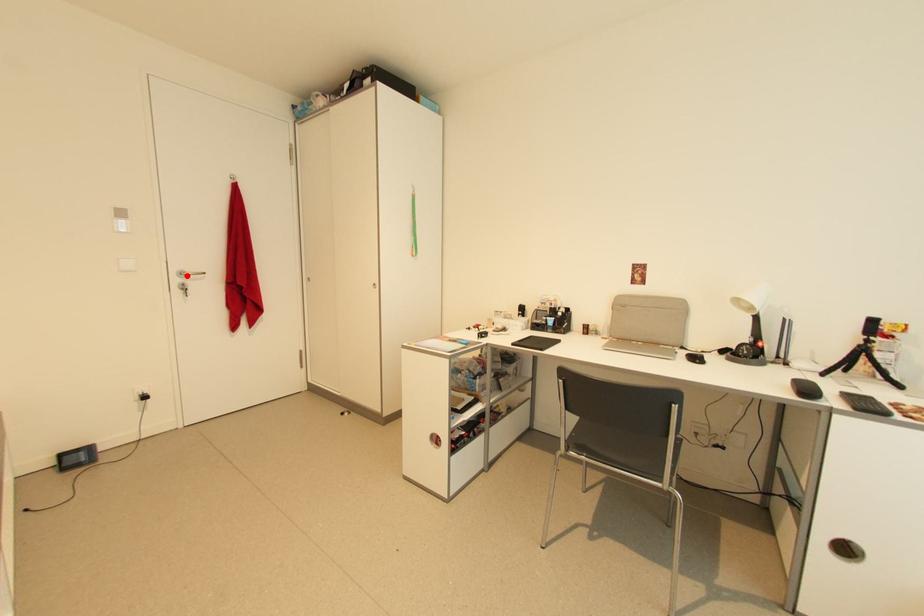
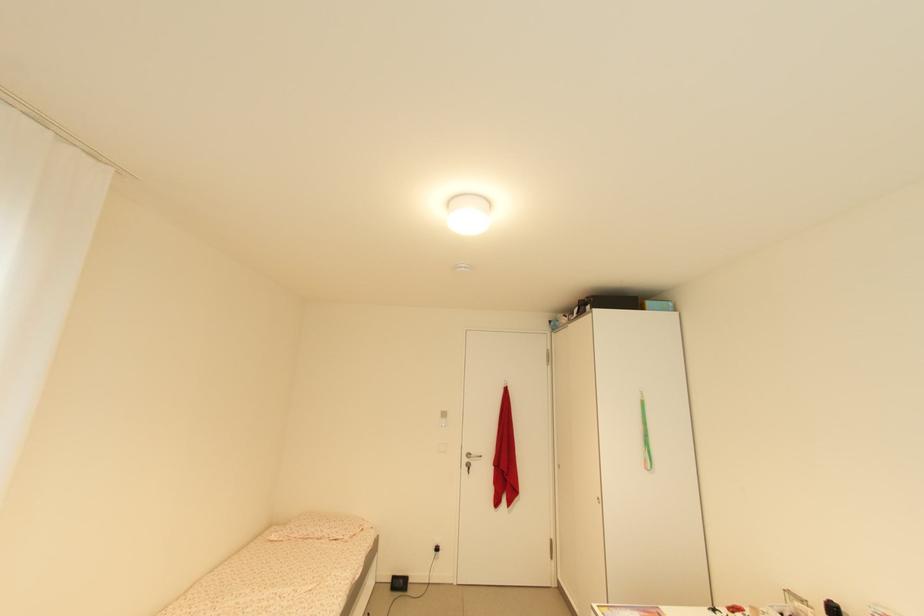
The point at the highlighted location is marked in the first image. Where is the corresponding point in the second image?

(473, 456)